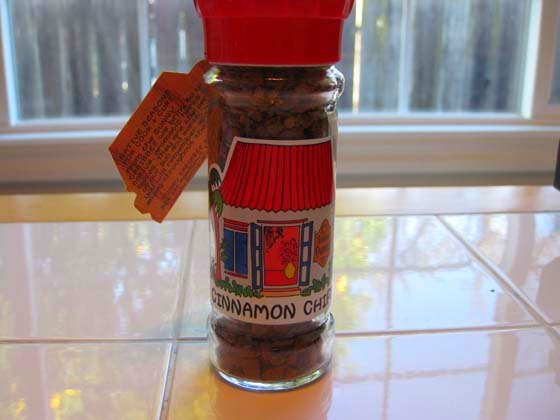
Where is `entrance`? entrance is located at coordinates (281, 261).